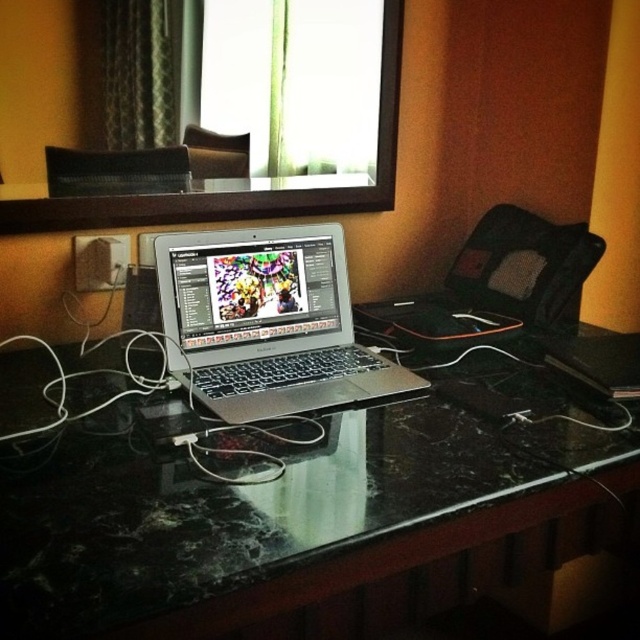
You are organizing cables for a new laptop setup. You have the black marble computer desk at center and the silver metallic laptop at center. Which object should you place first to ensure proper cable management?

The silver metallic laptop at center should be placed first because the black marble computer desk at center is in front of it, meaning the desk is closer to the user and the laptop needs to be positioned on top of the desk for cable access.

You are organizing a workspace and need to place a new monitor between the black marble computer desk at center and the silver metallic laptop at center. Based on their positions, which side of the laptop should the monitor be placed on to align with the desk?

The black marble computer desk at center is positioned on the right side of the silver metallic laptop at center, so the monitor should be placed to the right of the silver metallic laptop at center to align with the desk.